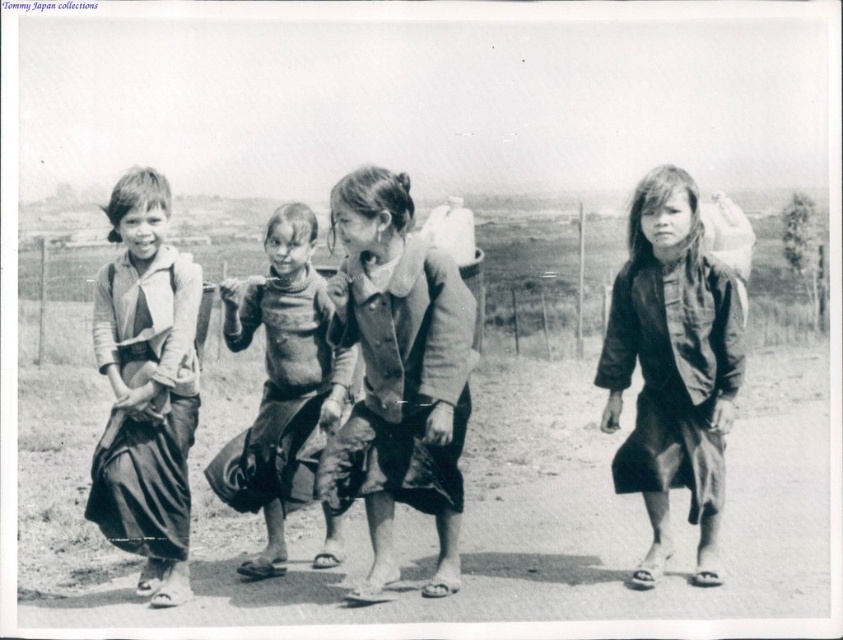
Is the position of dirt field at lower left more distant than that of matte gray sweater at left?

No, it is not.

The width and height of the screenshot is (843, 640). What are the coordinates of `dirt field at lower left` in the screenshot? It's located at (466, 512).

Is dirt field at lower left to the left of dark gray fabric dress at center from the viewer's perspective?

Correct, you'll find dirt field at lower left to the left of dark gray fabric dress at center.

Between dirt field at lower left and dark gray fabric dress at center, which one has less height?

dirt field at lower left

Describe the element at coordinates (466, 512) in the screenshot. I see `dirt field at lower left` at that location.

This screenshot has width=843, height=640. I want to click on dirt field at lower left, so click(x=466, y=512).

From the picture: Is matte gray sweater at left above rough fabric shirt at center?

Correct, matte gray sweater at left is located above rough fabric shirt at center.

Which is below, matte gray sweater at left or rough fabric shirt at center?

rough fabric shirt at center

Where is `matte gray sweater at left`? This screenshot has height=640, width=843. matte gray sweater at left is located at coordinates (146, 387).